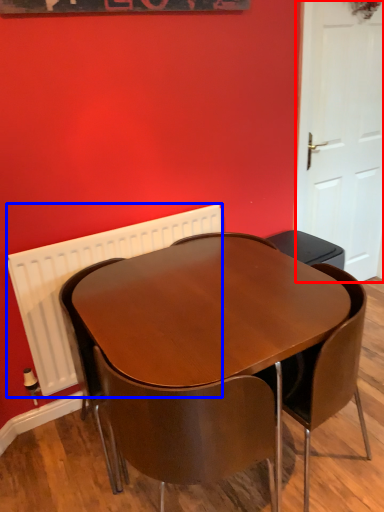
Question: Which point is closer to the camera, door (highlighted by a red box) or radiator (highlighted by a blue box)?

Choices:
 (A) door
 (B) radiator

Answer: (B)